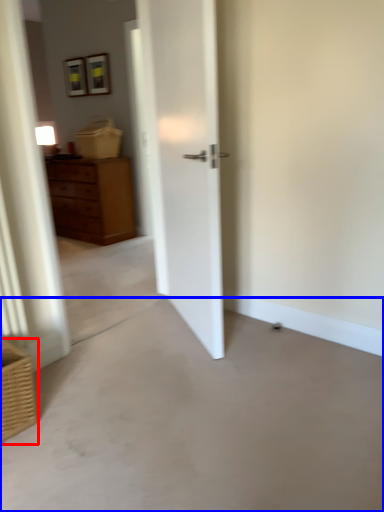
Question: Which point is closer to the camera, basket (highlighted by a red box) or concrete (highlighted by a blue box)?

Choices:
 (A) basket
 (B) concrete

Answer: (B)